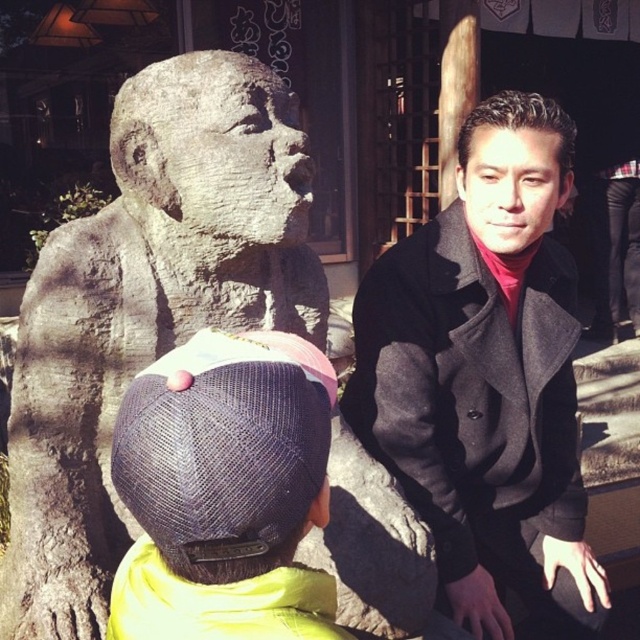
Question: Observing the image, what is the correct spatial positioning of gray stone statue at center in reference to denim cap at lower left?

Choices:
 (A) above
 (B) below

Answer: (A)

Question: Does gray stone statue at center lie behind denim cap at lower left?

Choices:
 (A) no
 (B) yes

Answer: (B)

Question: Is gray stone statue at center to the right of dark gray wool coat at right from the viewer's perspective?

Choices:
 (A) no
 (B) yes

Answer: (A)

Question: Among these points, which one is farthest from the camera?

Choices:
 (A) (125, 342)
 (B) (236, 426)
 (C) (413, 497)

Answer: (C)

Question: Which of the following is the farthest from the observer?

Choices:
 (A) (294, 538)
 (B) (544, 364)
 (C) (124, 225)

Answer: (B)

Question: Based on their relative distances, which object is farther from the gray stone statue at center?

Choices:
 (A) dark gray wool coat at right
 (B) denim cap at lower left

Answer: (B)